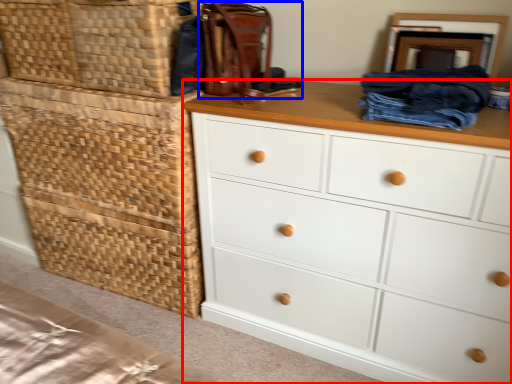
Question: Among these objects, which one is farthest to the camera, chest of drawers (highlighted by a red box) or handbag (highlighted by a blue box)?

Choices:
 (A) chest of drawers
 (B) handbag

Answer: (B)